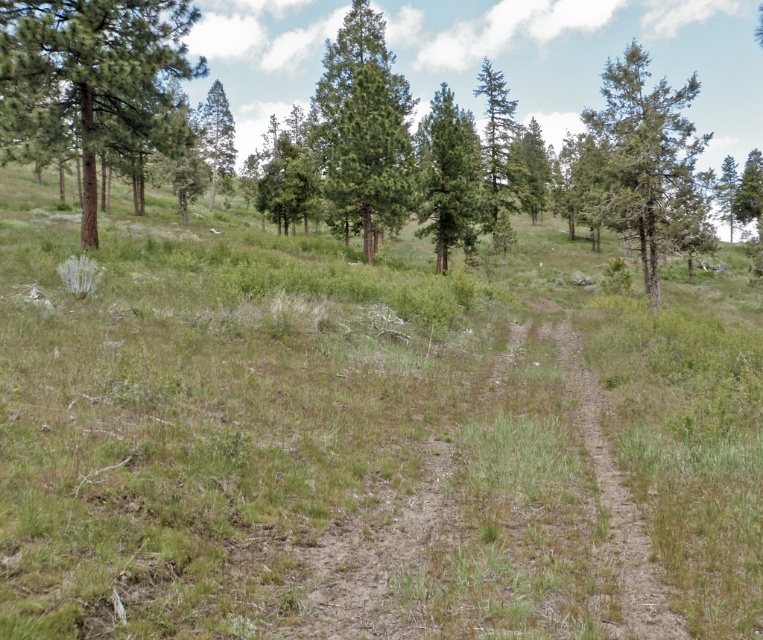
Is green textured pine at center to the right of green textured pine at right from the viewer's perspective?

Incorrect, green textured pine at center is not on the right side of green textured pine at right.

Measure the distance between green textured pine at center and camera.

They are 31.73 meters apart.

Who is more forward, (324, 76) or (623, 125)?

Point (623, 125)

I want to click on green textured pine at center, so click(362, 125).

Is green textured pine at center shorter than dirt path at center?

In fact, green textured pine at center may be taller than dirt path at center.

Which is below, green textured pine at center or dirt path at center?

dirt path at center is below.

Locate an element on the screen. green textured pine at center is located at coordinates (362, 125).

Find the location of a particular element. The height and width of the screenshot is (640, 763). green textured pine at center is located at coordinates (362, 125).

Can you confirm if brown dirt track at center is wider than green textured pine at center?

In fact, brown dirt track at center might be narrower than green textured pine at center.

Does brown dirt track at center have a lesser height compared to green textured pine at center?

Correct, brown dirt track at center is not as tall as green textured pine at center.

Locate an element on the screen. This screenshot has height=640, width=763. brown dirt track at center is located at coordinates (494, 520).

Image resolution: width=763 pixels, height=640 pixels. What are the coordinates of `brown dirt track at center` in the screenshot? It's located at (494, 520).